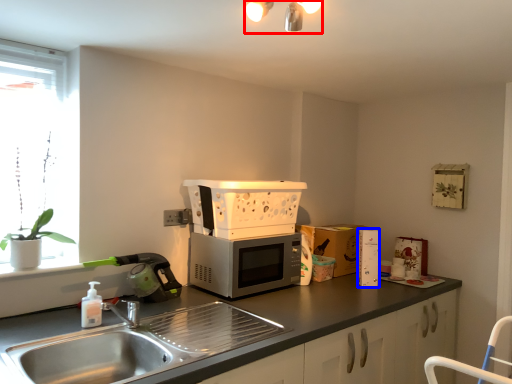
Question: Which object is closer to the camera taking this photo, light fixture (highlighted by a red box) or appliance (highlighted by a blue box)?

Choices:
 (A) light fixture
 (B) appliance

Answer: (A)